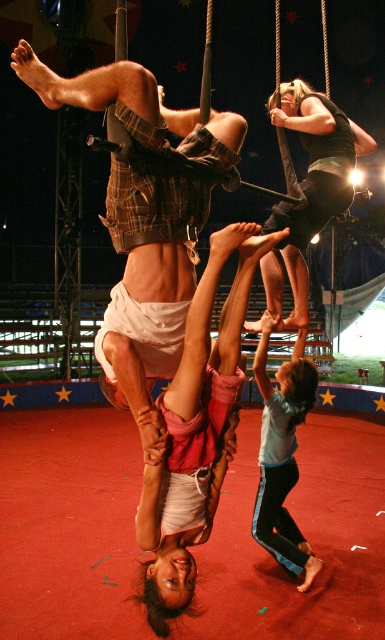
You are standing in the circus audience and want to take a photo of the light blue fabric pants at lower right. If your camera can focus on objects up to 3 meters away, will you be able to capture a clear image?

The light blue fabric pants at lower right are 3.47 meters away from the viewer, which is beyond the camera focus range of 3 meters. Therefore, the camera cannot capture a clear image of the light blue fabric pants at lower right.

You are an audience member sitting in the front row of the circus. You notice the light blue fabric pants at lower right and the black fabric swing at upper center. Which object is closer to the ground?

The light blue fabric pants at lower right are closer to the ground because they are positioned lower than the black fabric swing at upper center.

You are a spectator at the circus and want to take a photo of the black fabric swing at upper center without the light blue fabric pants at lower right blocking the view. Is the swing visible from your current position?

The light blue fabric pants at lower right is located below the black fabric swing at upper center, so the swing is above the pants and should be visible from your current position as long as there are no other obstructions.